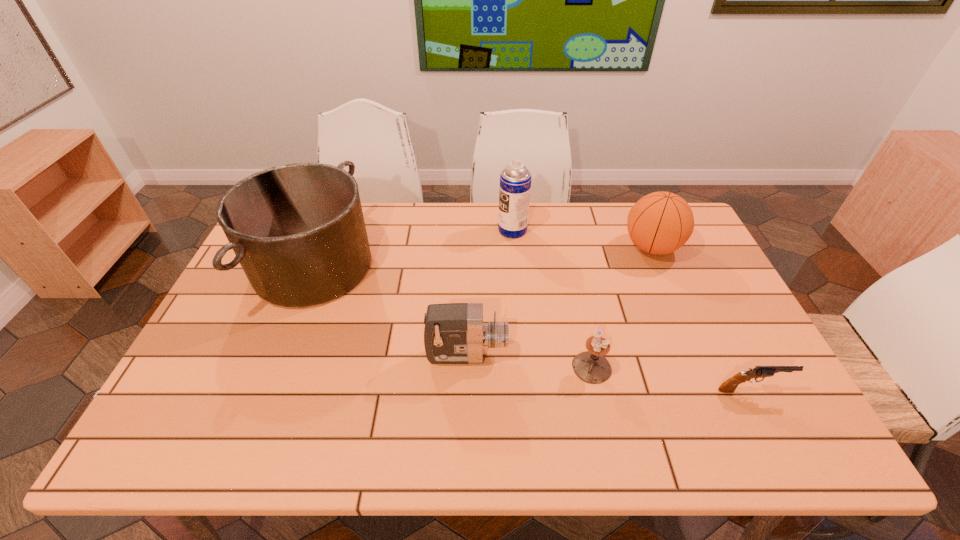
Image resolution: width=960 pixels, height=540 pixels. Find the location of `free spot between the shortest object and the leftmost object`. free spot between the shortest object and the leftmost object is located at coordinates (533, 328).

Identify the location of free space between the fifth tallest object and the camcorder. (529, 361).

The height and width of the screenshot is (540, 960). Identify the location of free spot between the aerosol can and the basketball. (582, 239).

In order to click on vacant region between the fourth object from left to right and the gun in this screenshot , I will do `click(671, 379)`.

Find the location of a particular element. free space between the gun and the fifth tallest object is located at coordinates click(x=671, y=379).

The image size is (960, 540). In order to click on free space between the shortest object and the pan in this screenshot , I will do `click(533, 328)`.

You are a GUI agent. You are given a task and a screenshot of the screen. Output one action in this format:
    pyautogui.click(x=<x>, y=<y>)
    Task: Click on the object identified as the second closest to the camcorder
    
    Given the screenshot: What is the action you would take?
    pyautogui.click(x=298, y=231)

Where is `object identified as the fourth closest to the camcorder`? The height and width of the screenshot is (540, 960). object identified as the fourth closest to the camcorder is located at coordinates (659, 223).

Find the location of a particular element. The height and width of the screenshot is (540, 960). blank space that satisfies the following two spatial constraints: 1. at the front of the candle holder, highlighting the lens; 2. on the left side of the camcorder is located at coordinates (467, 367).

The width and height of the screenshot is (960, 540). I want to click on free location that satisfies the following two spatial constraints: 1. on the back side of the candle holder; 2. at the front of the camcorder, highlighting the lens, so click(589, 355).